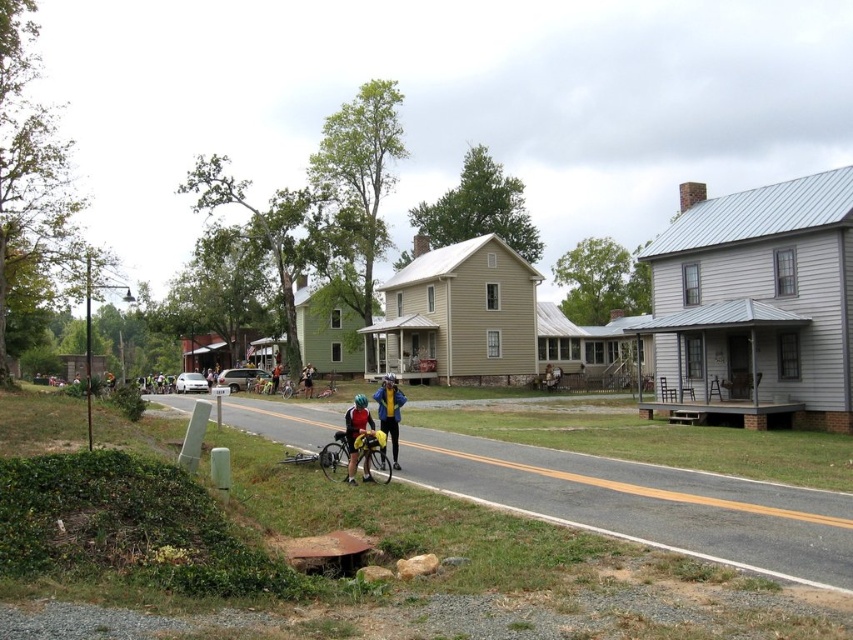
Can you confirm if yellow matte bicycle at center is taller than orange reflective vest at center?

In fact, yellow matte bicycle at center may be shorter than orange reflective vest at center.

Between yellow matte bicycle at center and orange reflective vest at center, which one is positioned lower?

orange reflective vest at center is below.

Who is more forward, (x=341, y=440) or (x=271, y=380)?

Positioned in front is point (x=341, y=440).

In order to click on yellow matte bicycle at center in this screenshot , I will do `click(374, 456)`.

Who is more forward, [354,460] or [303,378]?

Point [354,460]

This screenshot has height=640, width=853. Identify the location of matte yellow helmet at center. (357, 432).

This screenshot has height=640, width=853. What do you see at coordinates (374, 456) in the screenshot?
I see `yellow matte bicycle at center` at bounding box center [374, 456].

What are the coordinates of `yellow matte bicycle at center` in the screenshot? It's located at (374, 456).